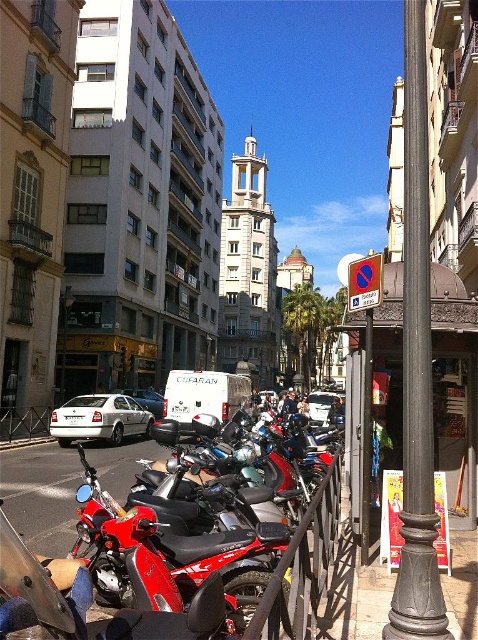
Which of these two, white matte sedan at center or brushed metal lamp post at center, stands shorter?

With less height is white matte sedan at center.

Between white matte sedan at center and brushed metal lamp post at center, which one appears on the right side from the viewer's perspective?

Positioned to the right is white matte sedan at center.

Locate an element on the screen. white matte sedan at center is located at coordinates (99, 419).

In the scene shown: Which is more to the right, white matte sedan at center or white matte van at center?

Positioned to the right is white matte van at center.

Is the position of white matte sedan at center more distant than that of white matte van at center?

No, it is in front of white matte van at center.

Which is in front, point (140, 413) or point (327, 408)?

Positioned in front is point (140, 413).

This screenshot has height=640, width=478. Find the location of `white matte sedan at center`. white matte sedan at center is located at coordinates (99, 419).

Who is positioned more to the left, white matte van at center or white matte car at center-left?

From the viewer's perspective, white matte car at center-left appears more on the left side.

Which is behind, point (308, 397) or point (138, 390)?

The point (308, 397) is more distant.

Where is `white matte van at center`? white matte van at center is located at coordinates (319, 406).